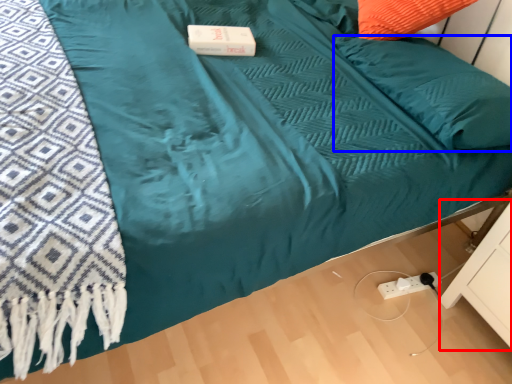
Question: Which object appears closest to the camera in this image, drawer (highlighted by a red box) or pillow (highlighted by a blue box)?

Choices:
 (A) drawer
 (B) pillow

Answer: (A)